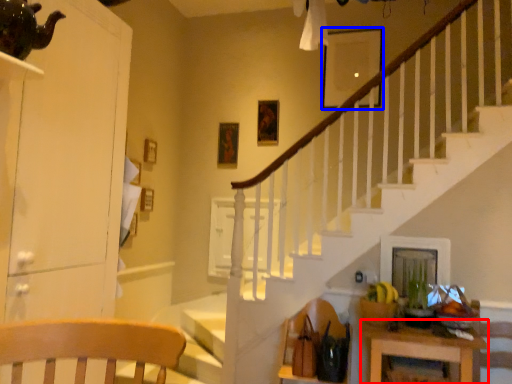
Question: Which object appears closest to the camera in this image, table (highlighted by a red box) or picture frame (highlighted by a blue box)?

Choices:
 (A) table
 (B) picture frame

Answer: (A)